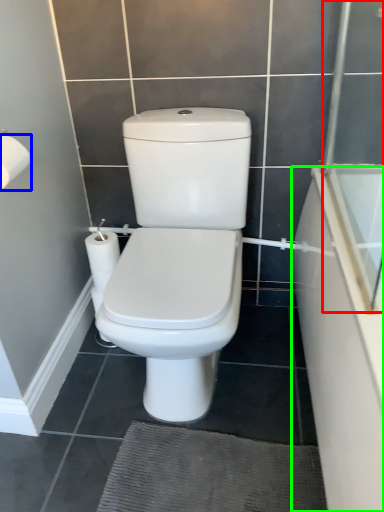
Question: Based on their relative distances, which object is farther from screen door (highlighted by a red box)? Choose from toilet paper (highlighted by a blue box) and bath (highlighted by a green box).

Choices:
 (A) toilet paper
 (B) bath

Answer: (A)